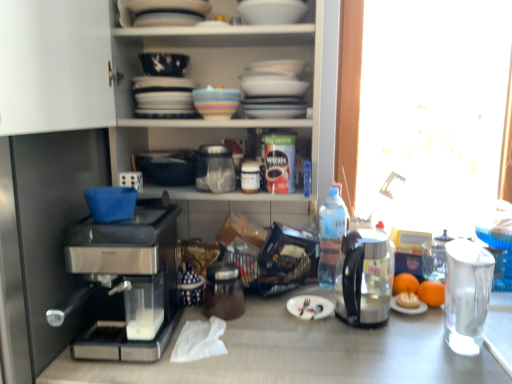
Question: Does matte black bowl at upper center lie in front of silver metallic fork at center?

Choices:
 (A) no
 (B) yes

Answer: (A)

Question: Can you confirm if matte black bowl at upper center is smaller than silver metallic fork at center?

Choices:
 (A) yes
 (B) no

Answer: (B)

Question: Is matte black bowl at upper center next to silver metallic fork at center?

Choices:
 (A) no
 (B) yes

Answer: (A)

Question: Is matte black bowl at upper center facing away from silver metallic fork at center?

Choices:
 (A) yes
 (B) no

Answer: (B)

Question: From a real-world perspective, is matte black bowl at upper center positioned over silver metallic fork at center based on gravity?

Choices:
 (A) yes
 (B) no

Answer: (A)

Question: Is silver metallic fork at center surrounded by matte black bowl at upper center?

Choices:
 (A) no
 (B) yes

Answer: (A)

Question: Is sleek metallic coffee maker at left thinner than transparent glass coffee pot at right?

Choices:
 (A) yes
 (B) no

Answer: (B)

Question: Does sleek metallic coffee maker at left touch transparent glass coffee pot at right?

Choices:
 (A) no
 (B) yes

Answer: (A)

Question: Is sleek metallic coffee maker at left taller than transparent glass coffee pot at right?

Choices:
 (A) no
 (B) yes

Answer: (B)

Question: Is there a large distance between sleek metallic coffee maker at left and transparent glass coffee pot at right?

Choices:
 (A) no
 (B) yes

Answer: (A)

Question: Can you confirm if sleek metallic coffee maker at left is wider than transparent glass coffee pot at right?

Choices:
 (A) yes
 (B) no

Answer: (A)

Question: Does sleek metallic coffee maker at left turn towards transparent glass coffee pot at right?

Choices:
 (A) yes
 (B) no

Answer: (B)

Question: Does transparent plastic bottle at right, the 3th bottle viewed from the front, have a larger size compared to orange matte at right, arranged as the 1th orange when viewed from the right?

Choices:
 (A) yes
 (B) no

Answer: (A)